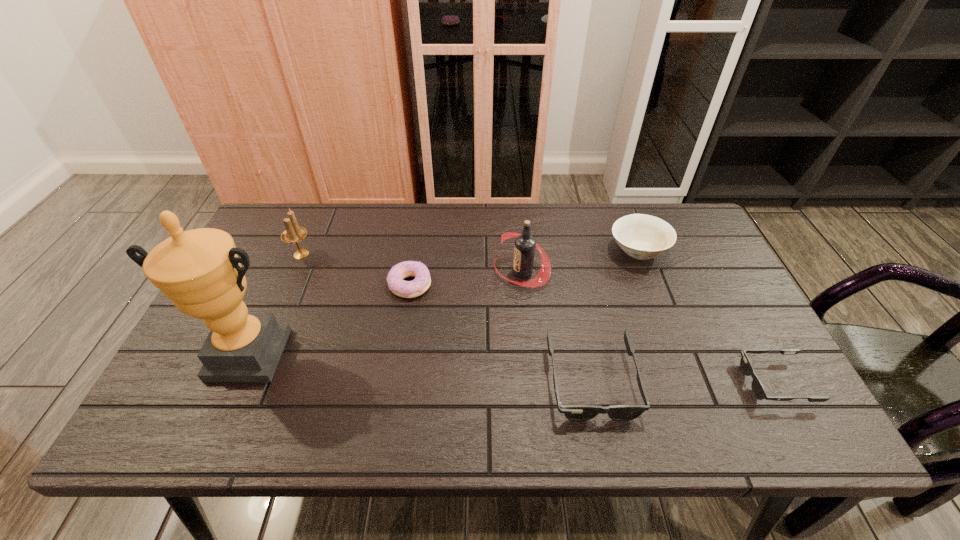
In the current image, all sunglassess are evenly spaced. To maintain this equal spacing, where should an additional sunglasses be placed on the left? Please point out a free spot. Please provide its 2D coordinates. Your answer should be formatted as a tuple, i.e. [(x, y)], where the tuple contains the x and y coordinates of a point satisfying the conditions above.

[(407, 380)]